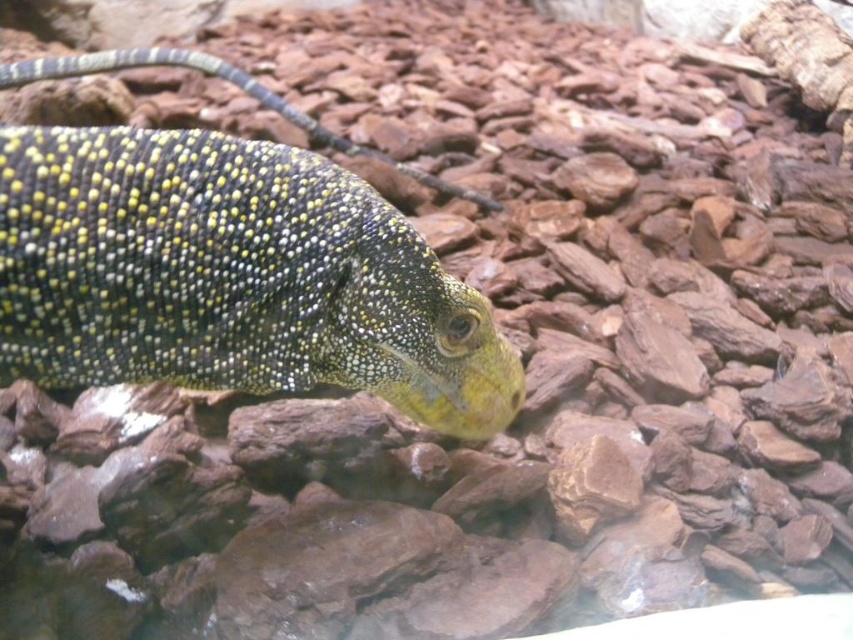
You are an observer looking at the monitor lizard on the stones. Which of the shiny green scales at center or shiny yellow scales at center is located to the right of the other?

The shiny green scales at center is positioned on the right side of shiny yellow scales at center.

You are a researcher observing the monitor lizard in its habitat. You notice a specific point marked at coordinates (231, 276). What feature of the lizard can be found at this point?

At point (231, 276) lies shiny green scales at center.